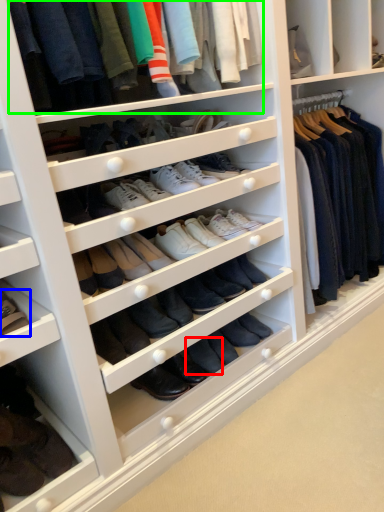
Question: Estimate the real-world distances between objects in this image. Which object is farther from shoe (highlighted by a red box), footwear (highlighted by a blue box) or clothing (highlighted by a green box)?

Choices:
 (A) footwear
 (B) clothing

Answer: (B)